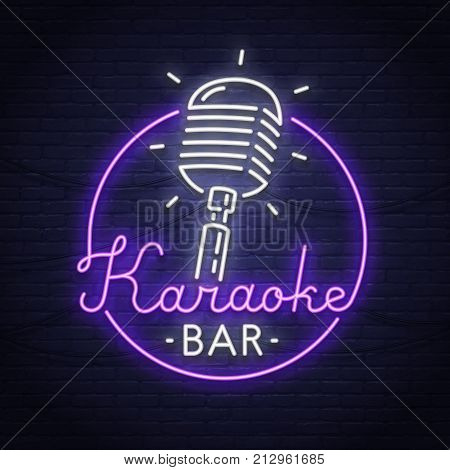
You are a GUI agent. You are given a task and a screenshot of the screen. Output one action in this format:
    pyautogui.click(x=<x>, y=<y>)
    Task: Click on the table
    
    Given the screenshot: What is the action you would take?
    pyautogui.click(x=382, y=132)